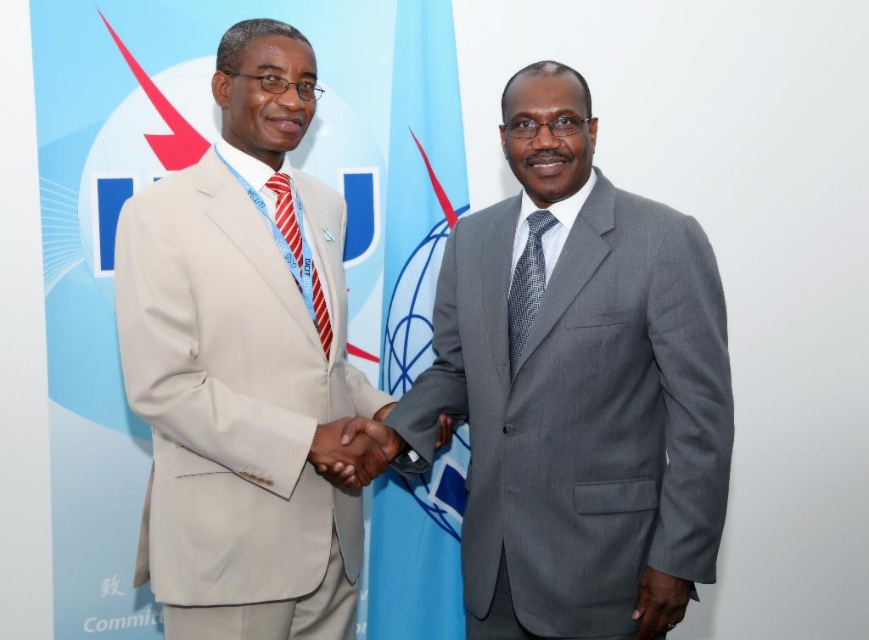
You are standing in front of a UN flag and want to take a photo of the gray suit at center. What are the coordinates where you should aim your camera?

You should aim your camera at coordinates point (576, 387) to capture the gray suit at center.

You are a photographer standing at the back of the room. You want to capture a photo of the smooth skin handshake at center and the dark gray fabric hand at lower right in the same frame. Considering the distance between them, do you think you can fit both subjects into the frame without moving closer?

The distance between the smooth skin handshake at center and the dark gray fabric hand at lower right is 23.38 inches. Since this distance is relatively manageable for a standard camera lens, you can likely capture both subjects in the same frame without needing to move closer.

You are a photographer at a UN event. You need to capture a photo of the smooth skin handshake at center. According to the scene description, where should you position your camera to ensure the handshake is centered in the photo?

To center the smooth skin handshake at center in the photo, position the camera so that the handshake is at coordinates point [353,449].